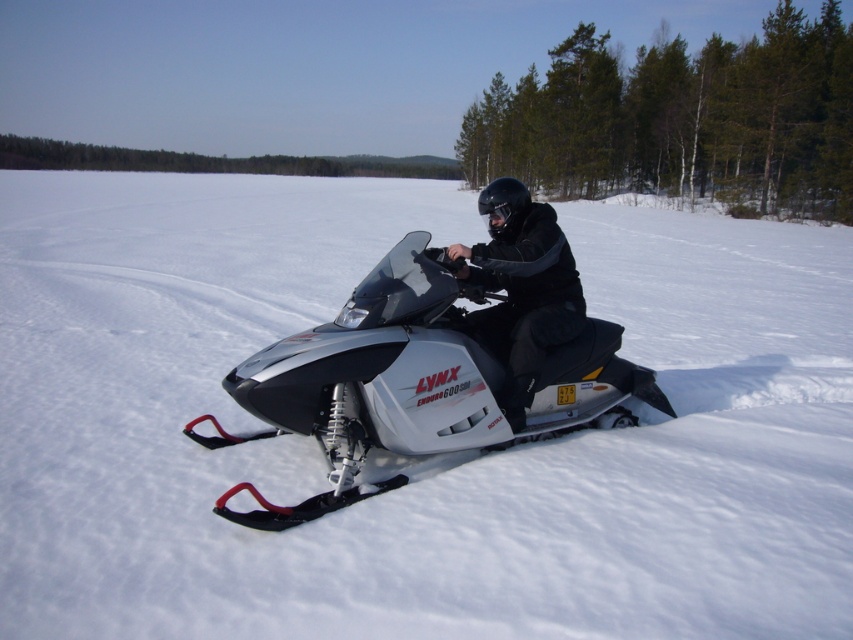
Who is more distant from viewer, (459, 612) or (412, 273)?

The point (412, 273) is more distant.

In the scene shown: Does white powdery snow at center appear on the right side of silver metallic snowmobile at center?

Yes, white powdery snow at center is to the right of silver metallic snowmobile at center.

Is point (763, 308) positioned in front of point (608, 381)?

No.

Identify the location of white powdery snow at center. The height and width of the screenshot is (640, 853). (413, 461).

Is point (9, 237) closer to viewer compared to point (473, 323)?

No, it is not.

Between point (554, 456) and point (544, 259), which one is positioned in front?

Positioned in front is point (544, 259).

You are a GUI agent. You are given a task and a screenshot of the screen. Output one action in this format:
    pyautogui.click(x=<x>, y=<y>)
    Task: Click on the white powdery snow at center
    
    Given the screenshot: What is the action you would take?
    pyautogui.click(x=413, y=461)

Looking at this image, can you confirm if silver metallic snowmobile at center is thinner than black matte jacket at center?

Incorrect, silver metallic snowmobile at center's width is not less than black matte jacket at center's.

Is point (604, 321) more distant than point (546, 262)?

Yes, it is behind point (546, 262).

This screenshot has width=853, height=640. Identify the location of silver metallic snowmobile at center. (412, 381).

Where is `silver metallic snowmobile at center`? Image resolution: width=853 pixels, height=640 pixels. silver metallic snowmobile at center is located at coordinates (412, 381).